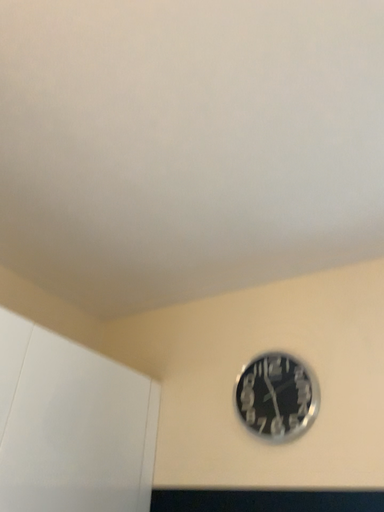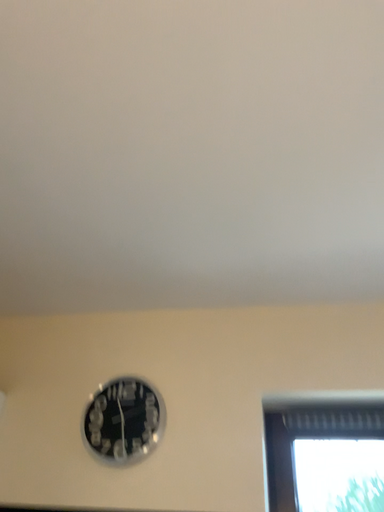
Question: How did the camera likely rotate when shooting the video?

Choices:
 (A) rotated left
 (B) rotated right

Answer: (B)